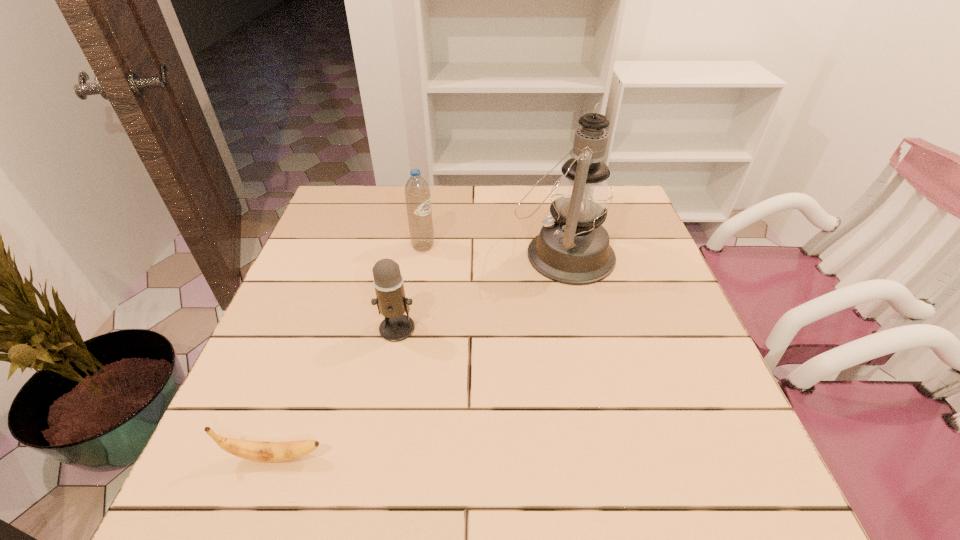
Identify the location of blank space at the far left corner of the desktop. (356, 212).

Image resolution: width=960 pixels, height=540 pixels. I want to click on vacant space at the near right corner, so click(697, 466).

Image resolution: width=960 pixels, height=540 pixels. I want to click on free space between the oil lamp and the nearest object, so click(420, 355).

Find the location of a particular element. Image resolution: width=960 pixels, height=540 pixels. empty space that is in between the oil lamp and the microphone is located at coordinates (480, 291).

Where is `free space between the microphone and the water bottle`? free space between the microphone and the water bottle is located at coordinates (411, 287).

Locate an element on the screen. vacant space that is in between the microphone and the shortest object is located at coordinates (337, 393).

Where is `free space between the oil lamp and the third farthest object`? The height and width of the screenshot is (540, 960). free space between the oil lamp and the third farthest object is located at coordinates (480, 291).

At what (x,y) coordinates should I click in order to perform the action: click on free spot between the third farthest object and the water bottle. Please return your answer as a coordinate pair (x, y). Looking at the image, I should click on (411, 287).

The image size is (960, 540). In order to click on blank region between the rightmost object and the shortest object in this screenshot , I will do `click(420, 355)`.

Where is `vacant space that's between the microphone and the leftmost object`? vacant space that's between the microphone and the leftmost object is located at coordinates (337, 393).